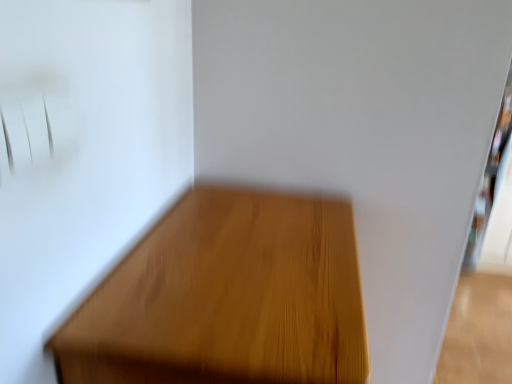
Locate an element on the screen. This screenshot has height=384, width=512. wooden table at center is located at coordinates (227, 298).

Describe the element at coordinates (227, 298) in the screenshot. This screenshot has width=512, height=384. I see `wooden table at center` at that location.

Measure the distance between wooden table at center and camera.

wooden table at center is 48.94 centimeters away from camera.

This screenshot has width=512, height=384. I want to click on wooden table at center, so click(x=227, y=298).